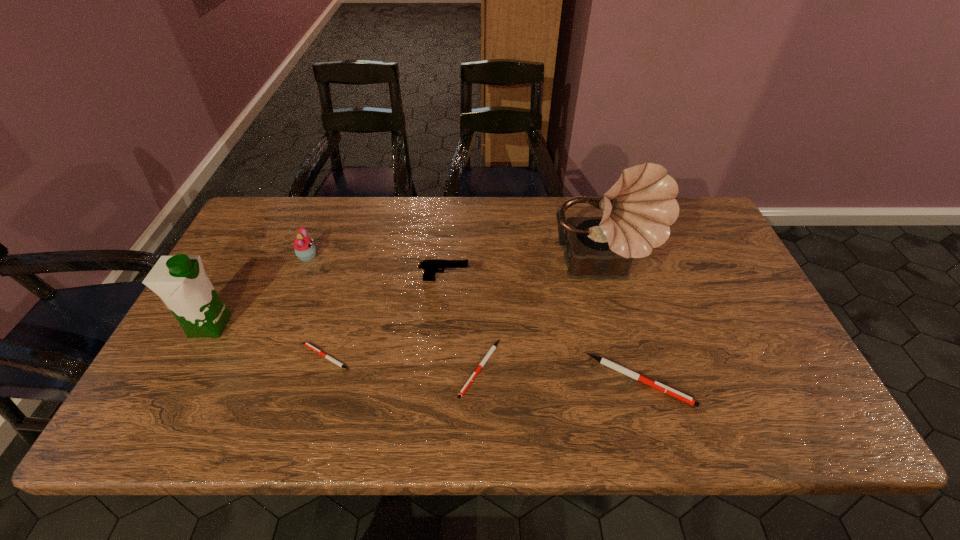
Where is `object at the far edge`? object at the far edge is located at coordinates (638, 210).

You are a GUI agent. You are given a task and a screenshot of the screen. Output one action in this format:
    pyautogui.click(x=<x>, y=<y>)
    Task: Click on the object that is at the left edge
    This screenshot has width=960, height=540.
    Given the screenshot: What is the action you would take?
    pyautogui.click(x=180, y=281)

Find the location of `free location at the far edge of the desktop`. free location at the far edge of the desktop is located at coordinates (526, 219).

This screenshot has height=540, width=960. In order to click on free region at the near edge in this screenshot , I will do `click(570, 388)`.

In the image, there is a desktop. In order to click on vacant region at the right edge in this screenshot , I will do `click(714, 268)`.

The image size is (960, 540). Identify the location of free region at the far left corner of the desktop. (266, 239).

Identify the location of free spot between the third tallest object and the fifth object from right to left. This screenshot has width=960, height=540. (317, 307).

Locate an element on the screen. Image resolution: width=960 pixels, height=540 pixels. empty location between the second pen from left to right and the leftmost pen is located at coordinates (403, 362).

Locate an element on the screen. empty space between the fifth tallest object and the second tallest object is located at coordinates (425, 353).

Where is `blank region between the sixth object from right to left and the fifth tallest object`? The width and height of the screenshot is (960, 540). blank region between the sixth object from right to left and the fifth tallest object is located at coordinates (473, 319).